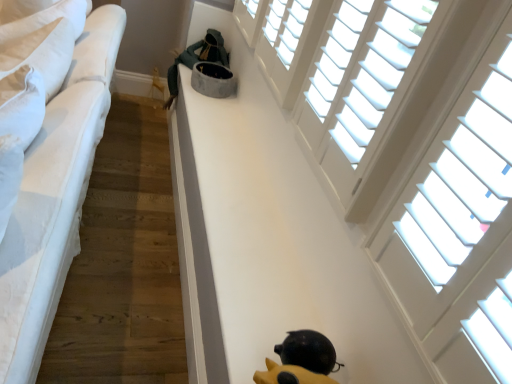
Question: Should I look upward or downward to see dark gray plush cat bed at upper center?

Choices:
 (A) up
 (B) down

Answer: (A)

Question: Is white fabric bed at left surrounded by dark gray plush cat bed at upper center?

Choices:
 (A) yes
 (B) no

Answer: (B)

Question: Can you confirm if dark gray plush cat bed at upper center is taller than white fabric bed at left?

Choices:
 (A) yes
 (B) no

Answer: (B)

Question: Considering the relative positions of dark gray plush cat bed at upper center and white fabric bed at left in the image provided, is dark gray plush cat bed at upper center to the right of white fabric bed at left from the viewer's perspective?

Choices:
 (A) yes
 (B) no

Answer: (A)

Question: Can you confirm if dark gray plush cat bed at upper center is wider than white fabric bed at left?

Choices:
 (A) yes
 (B) no

Answer: (B)

Question: Considering the relative sizes of dark gray plush cat bed at upper center and white fabric bed at left in the image provided, is dark gray plush cat bed at upper center bigger than white fabric bed at left?

Choices:
 (A) yes
 (B) no

Answer: (B)

Question: Is dark gray plush cat bed at upper center not within white fabric bed at left?

Choices:
 (A) yes
 (B) no

Answer: (A)

Question: From the image's perspective, is yellow rubber duck at lower center over dark gray plush cat bed at upper center?

Choices:
 (A) yes
 (B) no

Answer: (B)

Question: From a real-world perspective, is yellow rubber duck at lower center over dark gray plush cat bed at upper center?

Choices:
 (A) yes
 (B) no

Answer: (A)

Question: Is yellow rubber duck at lower center closer to the viewer compared to dark gray plush cat bed at upper center?

Choices:
 (A) no
 (B) yes

Answer: (B)

Question: Is dark gray plush cat bed at upper center a part of yellow rubber duck at lower center?

Choices:
 (A) no
 (B) yes

Answer: (A)

Question: Is yellow rubber duck at lower center not close to dark gray plush cat bed at upper center?

Choices:
 (A) yes
 (B) no

Answer: (A)

Question: Considering the relative sizes of yellow rubber duck at lower center and dark gray plush cat bed at upper center in the image provided, is yellow rubber duck at lower center thinner than dark gray plush cat bed at upper center?

Choices:
 (A) yes
 (B) no

Answer: (A)

Question: Does white wood blinds at upper right, marked as the second window in a back-to-front arrangement, have a greater width compared to yellow rubber duck at lower center?

Choices:
 (A) yes
 (B) no

Answer: (B)